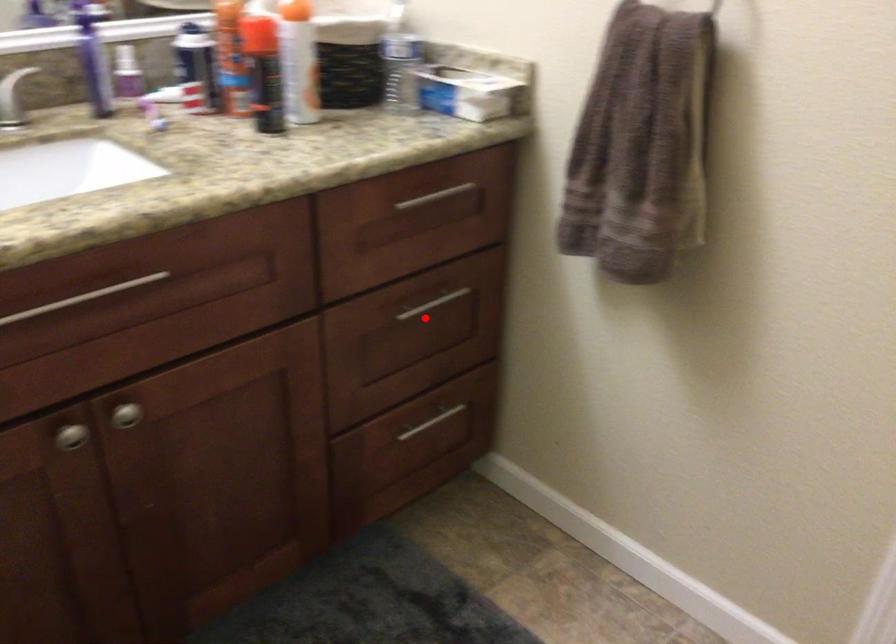
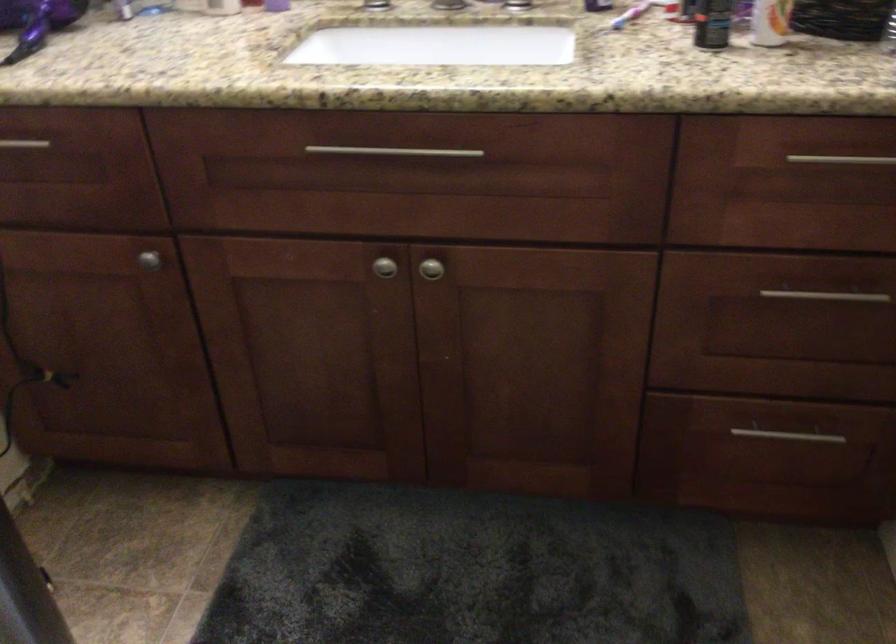
Question: I am providing you with two images of the same scene from different viewpoints. Given a red point in image1, look at the same physical point in image2. Is it:

Choices:
 (A) Closer to the viewpoint
 (B) Farther from the viewpoint

Answer: (A)